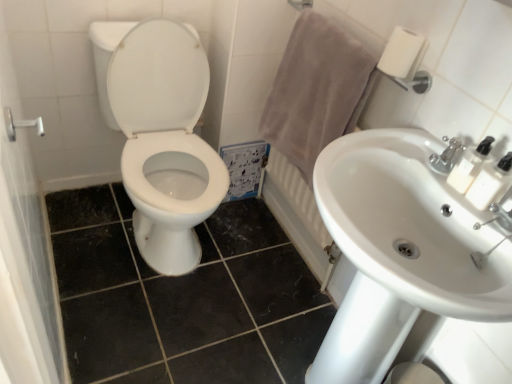
Locate an element on the screen. Image resolution: width=512 pixels, height=384 pixels. vacant space behind white matte toilet paper at upper right is located at coordinates (359, 41).